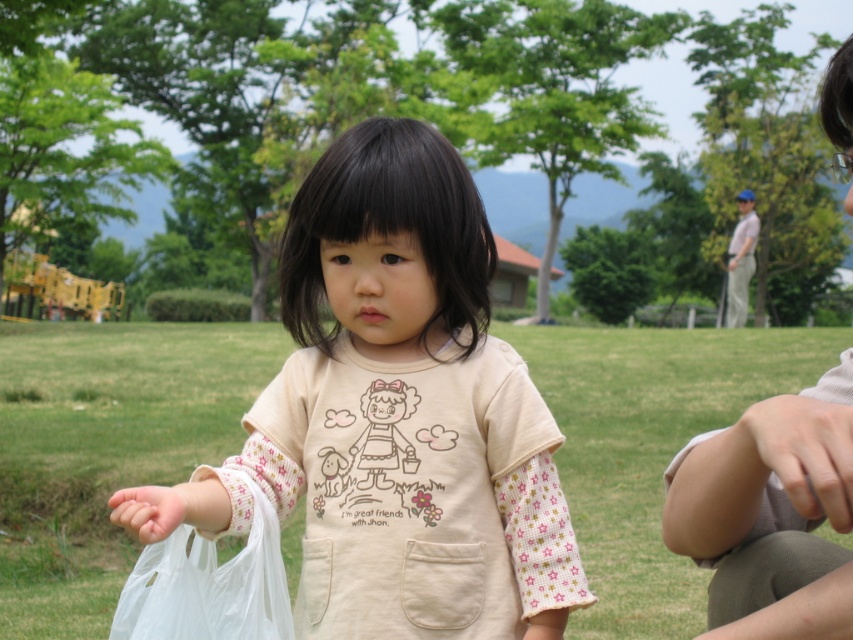
Does point (268, 589) come behind point (178, 520)?

Yes, it is.

Identify the location of transparent plastic bag at lower left. (207, 586).

Find the location of a particular element. transparent plastic bag at lower left is located at coordinates (207, 586).

Does beige cotton shirt at center have a smaller size compared to light beige fabric at upper right?

Yes, beige cotton shirt at center is smaller than light beige fabric at upper right.

Who is more forward, (392, 548) or (772, 538)?

Point (772, 538) is more forward.

Is point (483, 236) positioned before point (701, 554)?

No, it is not.

Locate an element on the screen. beige cotton shirt at center is located at coordinates (403, 412).

Who is more forward, (51, 628) or (807, 582)?

Point (807, 582) is in front.

Which is more to the left, green grass at center or light beige fabric at upper right?

green grass at center

I want to click on green grass at center, so click(x=648, y=445).

At what (x,y) coordinates should I click in order to perform the action: click on green grass at center. Please return your answer as a coordinate pair (x, y). Looking at the image, I should click on (648, 445).